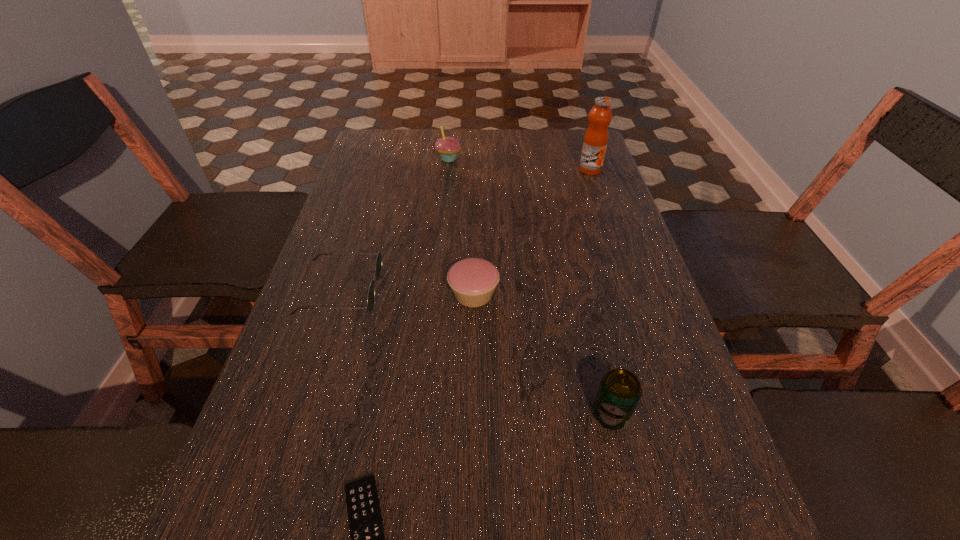
Where is `free space that satisfies the following two spatial constraints: 1. on the front-facing side of the leftmost object; 2. on the right side of the fourth tallest object`? The image size is (960, 540). free space that satisfies the following two spatial constraints: 1. on the front-facing side of the leftmost object; 2. on the right side of the fourth tallest object is located at coordinates (340, 294).

Locate an element on the screen. vacant area that satisfies the following two spatial constraints: 1. on the front-facing side of the second nearest object; 2. on the right side of the second shortest object is located at coordinates pos(301,414).

Find the location of a particular element. The height and width of the screenshot is (540, 960). vacant space that satisfies the following two spatial constraints: 1. on the front side of the second tallest object; 2. on the front-facing side of the leftmost object is located at coordinates (436, 291).

You are a GUI agent. You are given a task and a screenshot of the screen. Output one action in this format:
    pyautogui.click(x=<x>, y=<y>)
    Task: Click on the vacant space that satisfies the following two spatial constraints: 1. on the back side of the shorter cupcake; 2. on the front-facing side of the fifth tallest object
    Image resolution: width=960 pixels, height=540 pixels.
    Given the screenshot: What is the action you would take?
    pyautogui.click(x=473, y=291)

In order to click on free region that satisfies the following two spatial constraints: 1. on the front side of the beer can; 2. on the left side of the second tallest object in this screenshot , I will do `click(423, 414)`.